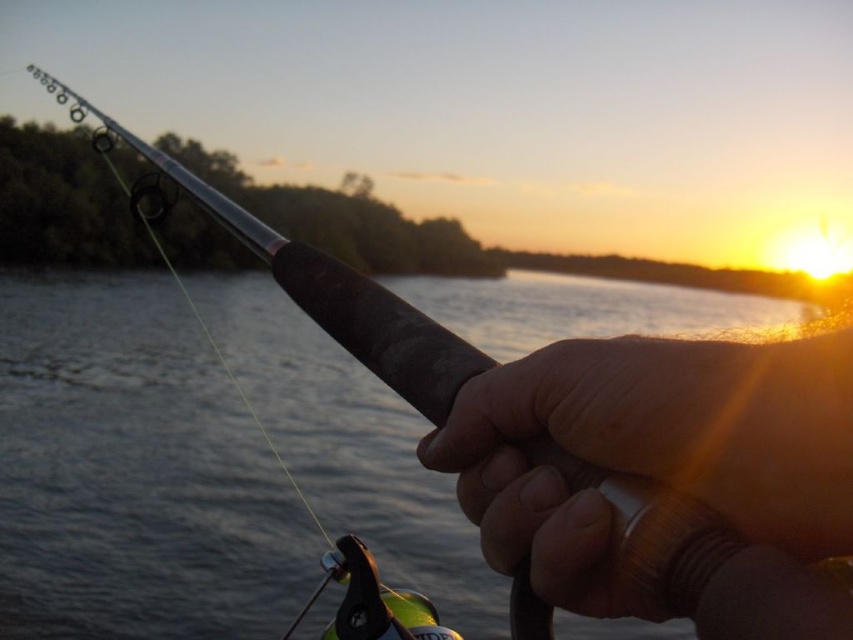
You are a photographer aiming to capture the fishing rod and its surroundings. Based on the scene, which object, the translucent water at fishing rod right or the smooth leather handle at center, would you focus on to ensure the widest part of the scene is in your shot?

The translucent water at fishing rod right might be wider than the smooth leather handle at center, so focusing on the translucent water at fishing rod right would capture the wider part of the scene.

You are an observer looking at the fishing scene. You notice the smooth leather handle at center and the translucent water at fishing rod right. Which object is closer to you?

The translucent water at fishing rod right is closer to you because the smooth leather handle at center is behind it.

You are a fisherman trying to measure the distance between the translucent water at fishing rod right and the smooth leather handle at center. Do you think the distance is more than 5 meters?

The distance between the translucent water at fishing rod right and the smooth leather handle at center is 4.98 meters, which is just under 5 meters. Therefore, the distance is not more than 5 meters.